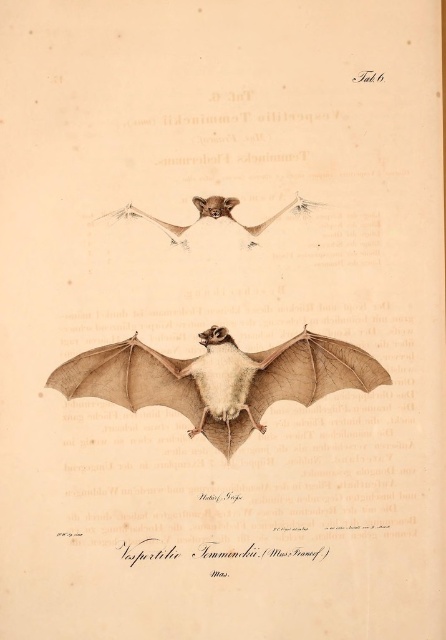
You are a researcher examining the image of two bats. You notice the brown textured wing at center and the brown textured bat at center. Which one appears taller in the illustration?

The brown textured wing at center is taller than the brown textured bat at center according to the illustration.

You are a researcher examining the illustration of two bats. You notice the brown textured wing at center and the brown textured bat at center. Based on their positions, which one is placed lower in the image?

The brown textured wing at center is located below the brown textured bat at center, so it is placed lower in the image.